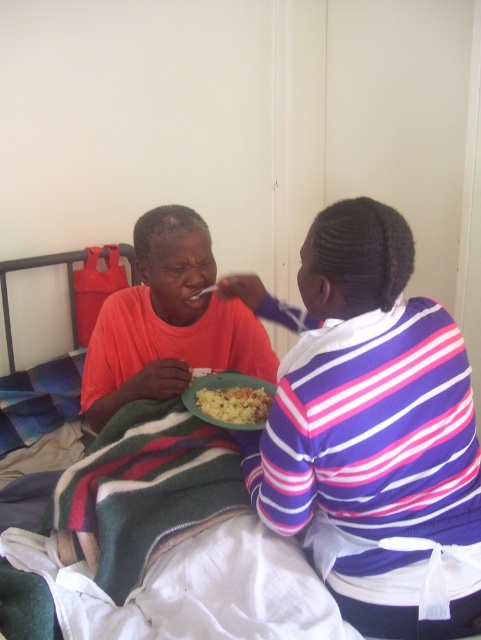
You are a nurse in a hospital room. You need to hand a medical chart to the person in the purple striped shirt at upper right. The chart is 12 inches wide. Is there enough space between you and them to safely hand over the chart without touching?

The distance between you and the purple striped shirt at upper right is 35.28 inches, which is more than enough to safely hand over the 12 inch wide chart without any contact.

You are a nurse in the room and need to adjust the height of the feeding tray so that the yellowish matte food at center is level with the purple striped shirt at upper right. Based on the scene description, what should you do?

The purple striped shirt at upper right is taller than the yellowish matte food at center. To level them, you should raise the feeding tray to increase the height of the yellowish matte food at center until it matches the height of the purple striped shirt at upper right.

You are a nurse in a hospital room. You need to place a medical chart on the table so it doesn not block the view of the patient. The table is located at point (x=371, y=432). Where exactly should you place the chart?

The point (x=371, y=432) is on the purple striped shirt at upper right, so placing the medical chart there would block the view of the patient. Choose another location.